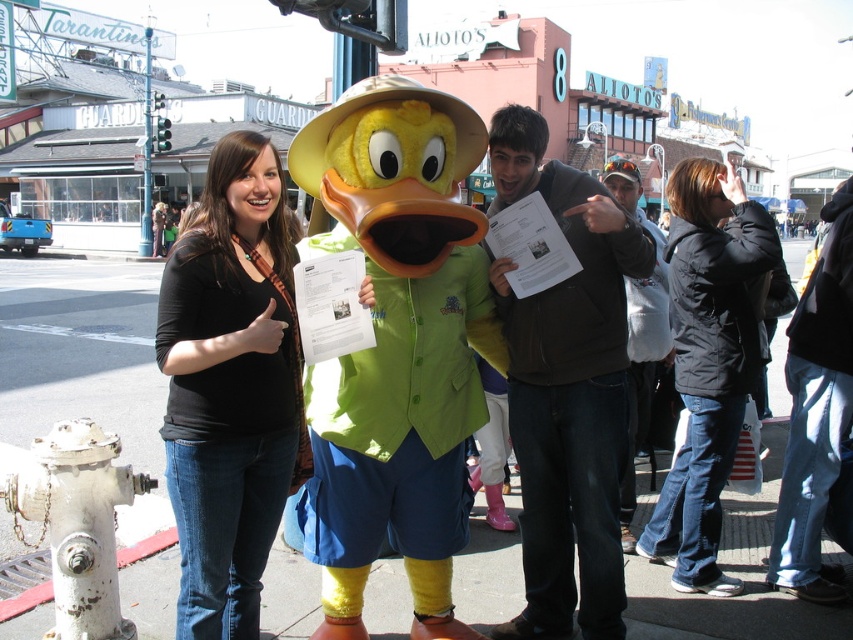
Which is more to the left, fluffy yellow duck at center or black matte shirt at center?

black matte shirt at center is more to the left.

In the scene shown: Can you confirm if fluffy yellow duck at center is positioned below black matte shirt at center?

Incorrect, fluffy yellow duck at center is not positioned below black matte shirt at center.

Is point (445, 224) behind point (229, 452)?

Yes.

Find the location of a particular element. fluffy yellow duck at center is located at coordinates (397, 348).

Can you confirm if fluffy yellow duck at center is smaller than black fabric jacket at lower right?

Actually, fluffy yellow duck at center might be larger than black fabric jacket at lower right.

Is point (397, 76) positioned after point (663, 548)?

No, it is in front of (663, 548).

Describe the element at coordinates (397, 348) in the screenshot. This screenshot has width=853, height=640. I see `fluffy yellow duck at center` at that location.

Locate an element on the screen. fluffy yellow duck at center is located at coordinates (397, 348).

Is black fabric jacket at lower right bigger than dark gray hoodie at center?

No.

Does black fabric jacket at lower right appear over dark gray hoodie at center?

No.

Which is in front, point (683, 496) or point (643, 220)?

Positioned in front is point (683, 496).

Locate an element on the screen. black fabric jacket at lower right is located at coordinates (711, 376).